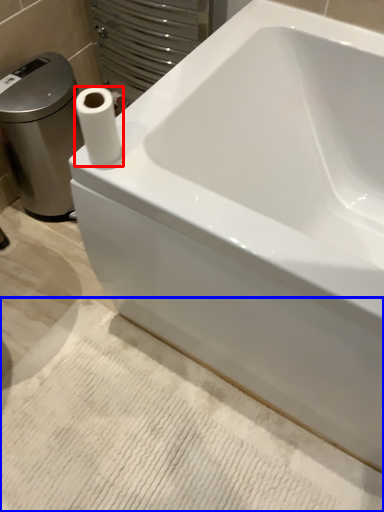
Question: Which point is further to the camera, paper towel (highlighted by a red box) or bath mat (highlighted by a blue box)?

Choices:
 (A) paper towel
 (B) bath mat

Answer: (B)